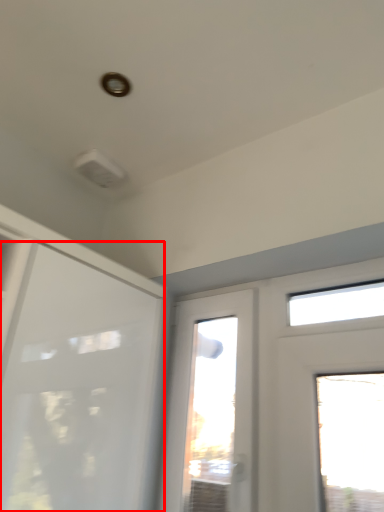
Question: From the image's perspective, what is the correct spatial relationship of door (annotated by the red box) in relation to window?

Choices:
 (A) below
 (B) above

Answer: (B)